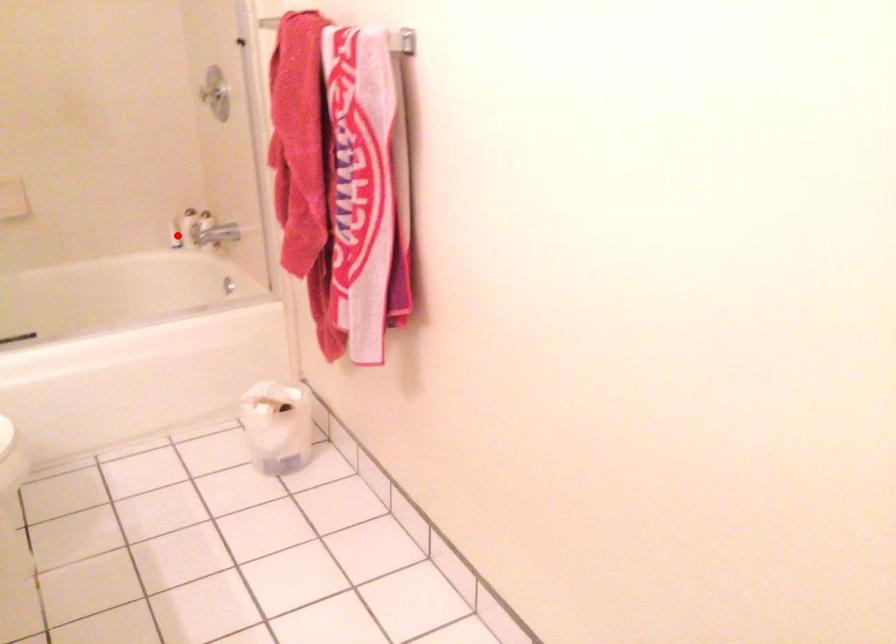
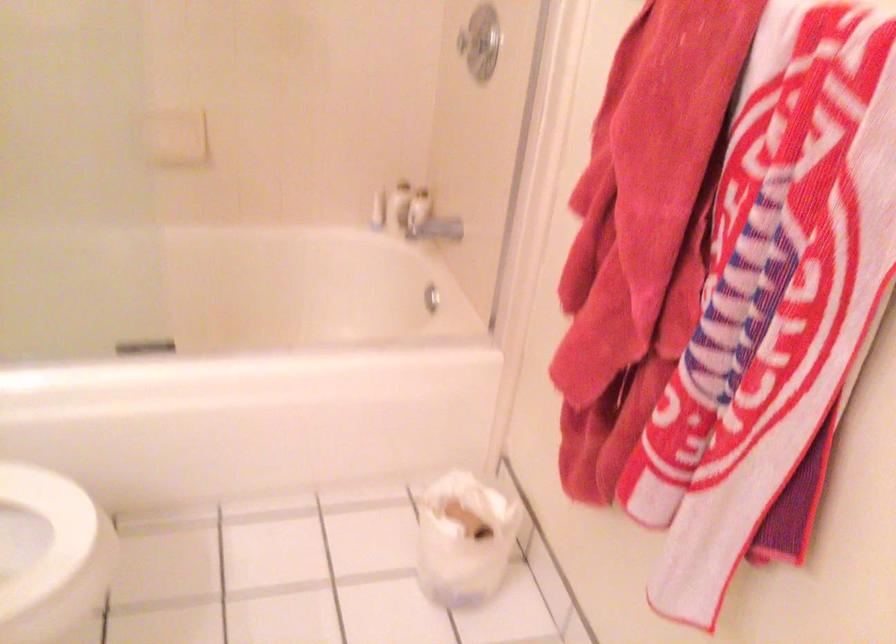
Question: I am providing you with two images of the same scene from different viewpoints. Given a red point in image1, look at the same physical point in image2. Is it:

Choices:
 (A) Closer to the viewpoint
 (B) Farther from the viewpoint

Answer: (A)